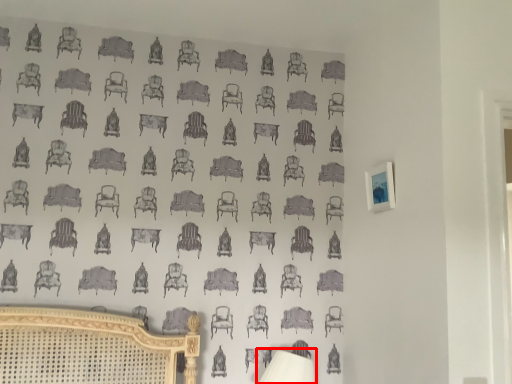
Question: From the image's perspective, where is table lamp (annotated by the red box) located in relation to picture frame in the image?

Choices:
 (A) below
 (B) above

Answer: (A)